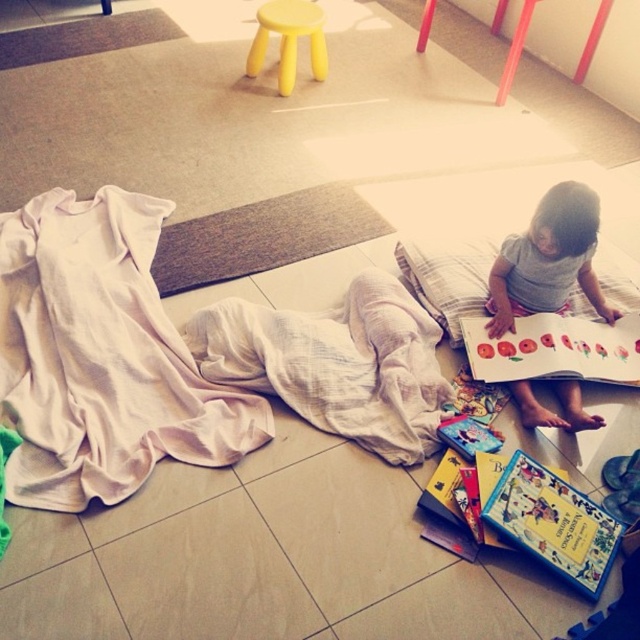
Who is higher up, gray cotton toddler at center or matte paper book at center?

Positioned higher is gray cotton toddler at center.

Does gray cotton toddler at center have a lesser height compared to matte paper book at center?

No.

Between point (579, 221) and point (536, 353), which one is positioned in front?

Point (579, 221) is more forward.

Where is `gray cotton toddler at center`? Image resolution: width=640 pixels, height=640 pixels. gray cotton toddler at center is located at coordinates (548, 260).

Is white cotton blanket at lower left shorter than yellow plastic stool at upper center?

No.

Does white cotton blanket at lower left have a smaller size compared to yellow plastic stool at upper center?

Actually, white cotton blanket at lower left might be larger than yellow plastic stool at upper center.

I want to click on white cotton blanket at lower left, so click(x=100, y=356).

Find the location of a particular element. This screenshot has width=640, height=640. white cotton blanket at lower left is located at coordinates (100, 356).

Who is taller, white cotton blanket at lower left or matte paper book at center?

white cotton blanket at lower left is taller.

Between point (51, 189) and point (618, 378), which one is positioned in front?

Point (618, 378) is in front.

Locate an element on the screen. white cotton blanket at lower left is located at coordinates (100, 356).